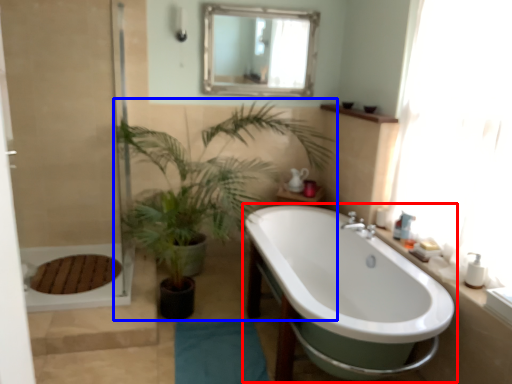
Question: Among these objects, which one is farthest to the camera, bathtub (highlighted by a red box) or houseplant (highlighted by a blue box)?

Choices:
 (A) bathtub
 (B) houseplant

Answer: (B)